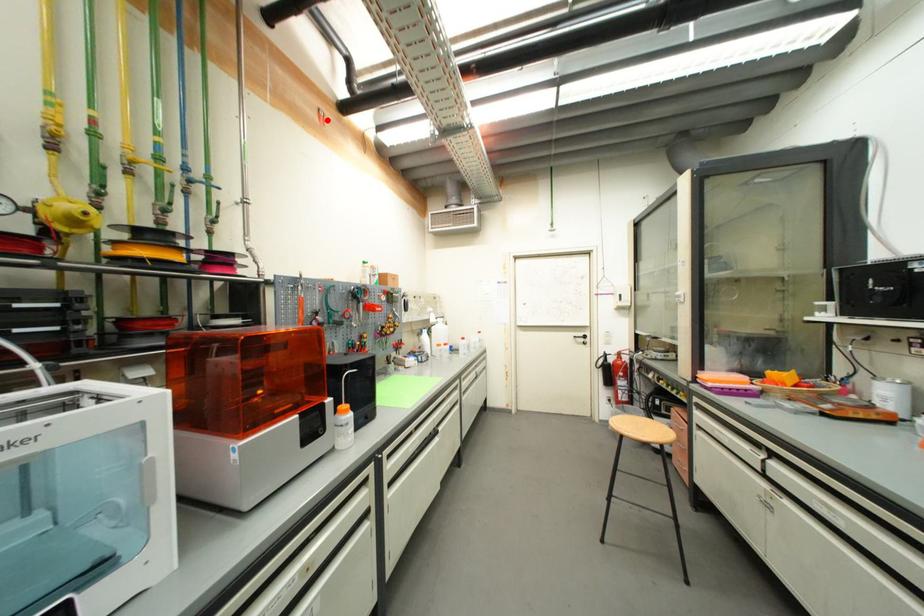
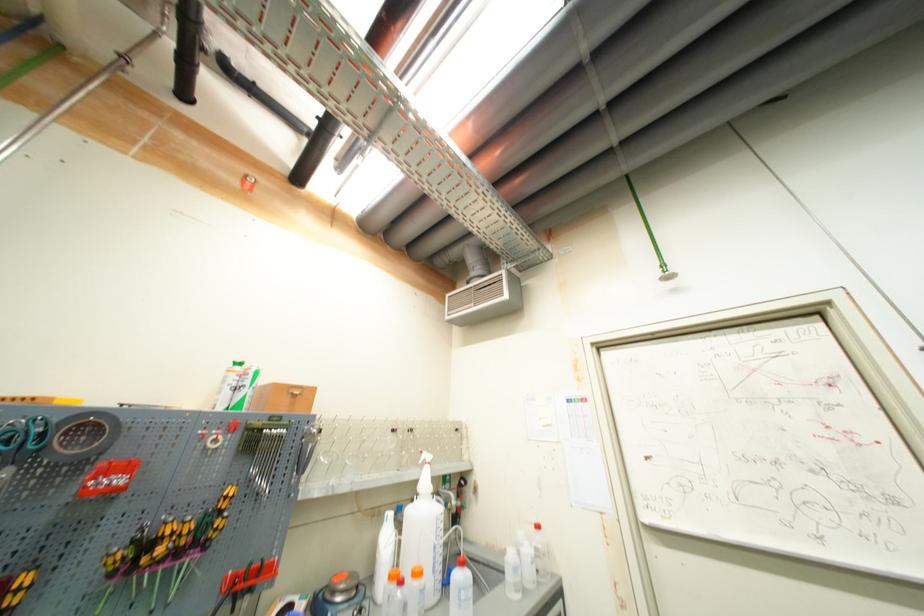
In the second image, find the point that corresponds to the highlighted location in the first image.

(253, 185)